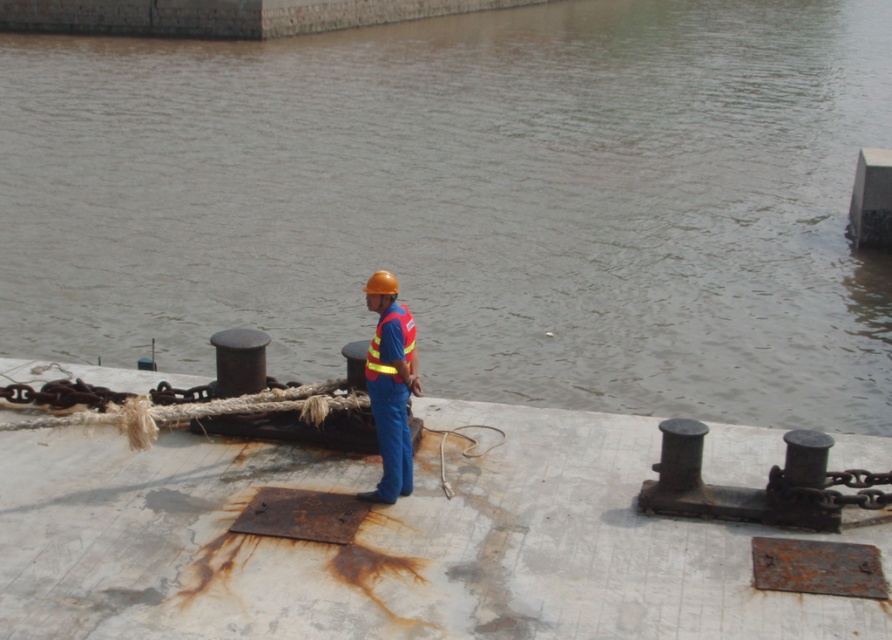
Is brown murky water at center to the left of reflective fabric safety vest at center from the viewer's perspective?

Correct, you'll find brown murky water at center to the left of reflective fabric safety vest at center.

Who is more forward, (764, 152) or (410, 339)?

Point (410, 339) is in front.

Find the location of a particular element. This screenshot has height=640, width=892. brown murky water at center is located at coordinates (469, 202).

Does brown murky water at center have a larger size compared to blue fabric worker at center?

Yes, brown murky water at center is bigger than blue fabric worker at center.

Can you confirm if brown murky water at center is positioned above blue fabric worker at center?

Indeed, brown murky water at center is positioned over blue fabric worker at center.

This screenshot has width=892, height=640. Identify the location of brown murky water at center. pyautogui.click(x=469, y=202).

This screenshot has height=640, width=892. In order to click on brown murky water at center in this screenshot , I will do `click(469, 202)`.

Does blue fabric worker at center have a greater width compared to reflective fabric safety vest at center?

Indeed, blue fabric worker at center has a greater width compared to reflective fabric safety vest at center.

You are a GUI agent. You are given a task and a screenshot of the screen. Output one action in this format:
    pyautogui.click(x=<x>, y=<y>)
    Task: Click on the blue fabric worker at center
    This screenshot has height=640, width=892.
    Given the screenshot: What is the action you would take?
    pyautogui.click(x=389, y=540)

Which is in front, point (422, 572) or point (403, 344)?

Point (422, 572) is more forward.

You are a GUI agent. You are given a task and a screenshot of the screen. Output one action in this format:
    pyautogui.click(x=<x>, y=<y>)
    Task: Click on the blue fabric worker at center
    
    Given the screenshot: What is the action you would take?
    pyautogui.click(x=389, y=540)